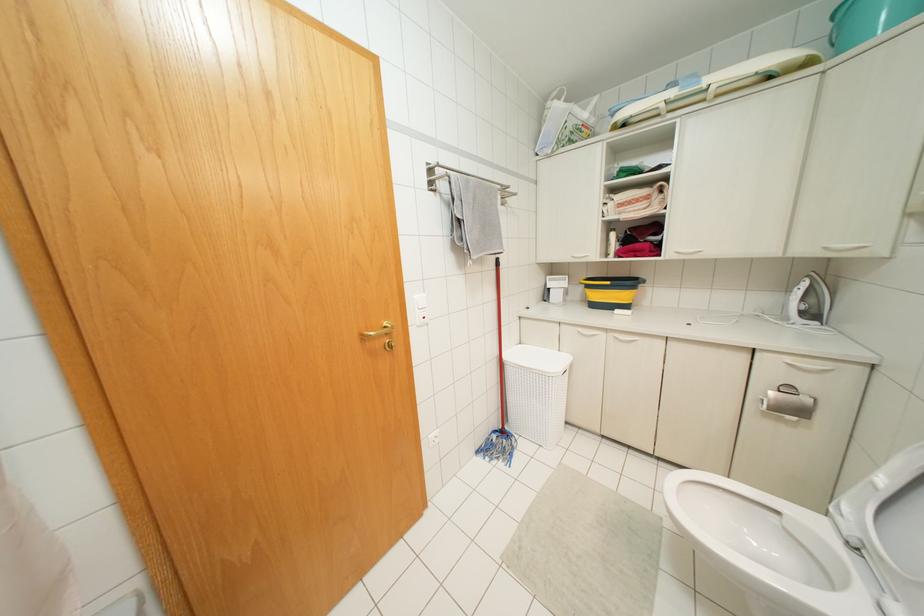
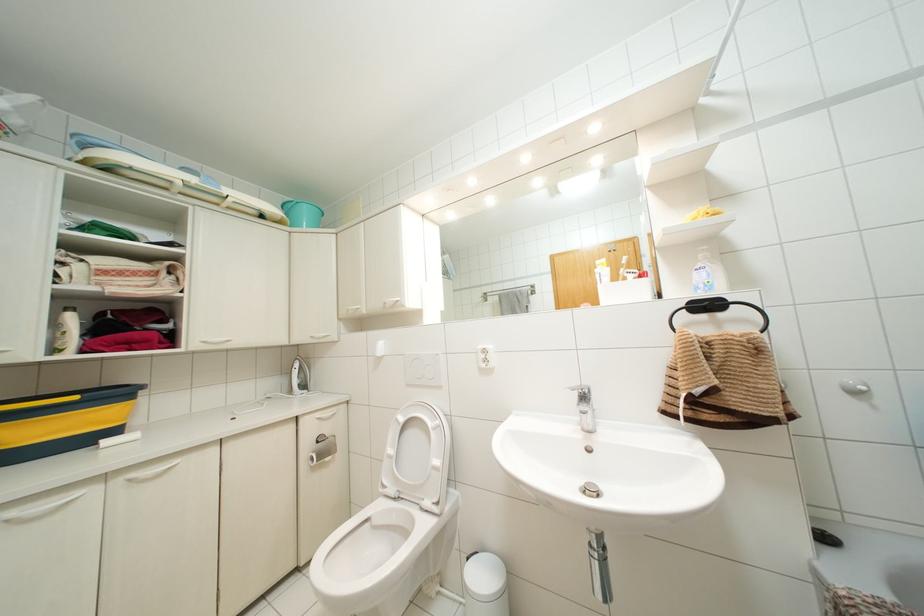
Question: Based on the continuous images, in which direction is the camera rotating? Reply with the corresponding letter.

Choices:
 (A) Left
 (B) Right
 (C) Up
 (D) Down

Answer: (B)